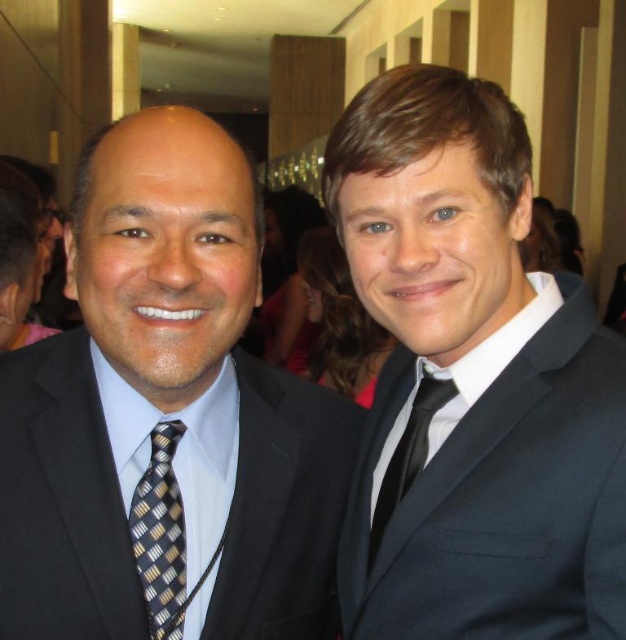
Who is positioned more to the left, black silk suit at left or black and gold striped tie at left?

black and gold striped tie at left

From the picture: Who is lower down, black silk suit at left or black and gold striped tie at left?

Positioned lower is black and gold striped tie at left.

Image resolution: width=626 pixels, height=640 pixels. Identify the location of black silk suit at left. (167, 417).

Who is taller, matte black suit at right or black and gold striped tie at left?

matte black suit at right is taller.

Consider the image. Who is higher up, matte black suit at right or black and gold striped tie at left?

matte black suit at right

Between point (501, 218) and point (183, 586), which one is positioned in front?

Point (183, 586)

This screenshot has height=640, width=626. Identify the location of matte black suit at right. (471, 384).

Who is more forward, (11, 570) or (481, 248)?

Positioned in front is point (11, 570).

Locate an element on the screen. The image size is (626, 640). black silk suit at left is located at coordinates (167, 417).

Locate an element on the screen. The image size is (626, 640). black silk suit at left is located at coordinates (167, 417).